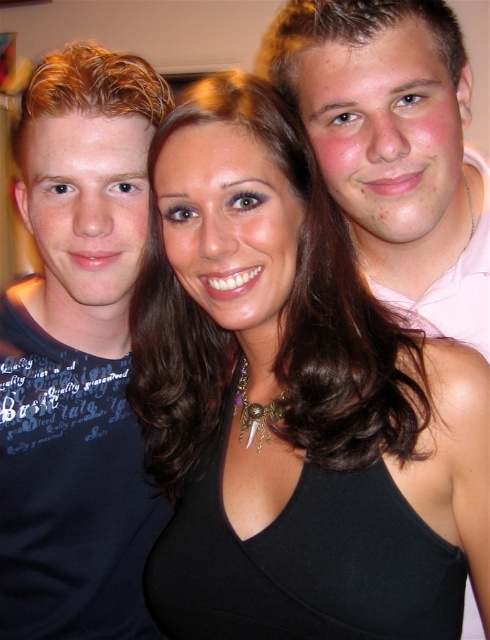
Question: Can you confirm if matte blue shirt at left is positioned below pink cotton shirt at right?

Choices:
 (A) no
 (B) yes

Answer: (B)

Question: Is black satin dress at center wider than pink cotton shirt at right?

Choices:
 (A) yes
 (B) no

Answer: (A)

Question: Among these points, which one is farthest from the camera?

Choices:
 (A) (132, 616)
 (B) (334, 460)

Answer: (A)

Question: Which object is positioned closest to the black satin dress at center?

Choices:
 (A) pink cotton shirt at right
 (B) matte blue shirt at left

Answer: (B)

Question: Is black satin dress at center behind pink cotton shirt at right?

Choices:
 (A) yes
 (B) no

Answer: (B)

Question: Which of these objects is positioned farthest from the pink cotton shirt at right?

Choices:
 (A) black satin dress at center
 (B) matte blue shirt at left

Answer: (B)